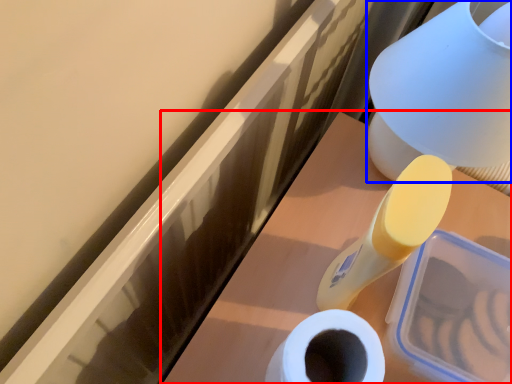
Question: Which of the following is the farthest to the observer, vanity (highlighted by a red box) or table lamp (highlighted by a blue box)?

Choices:
 (A) vanity
 (B) table lamp

Answer: (A)